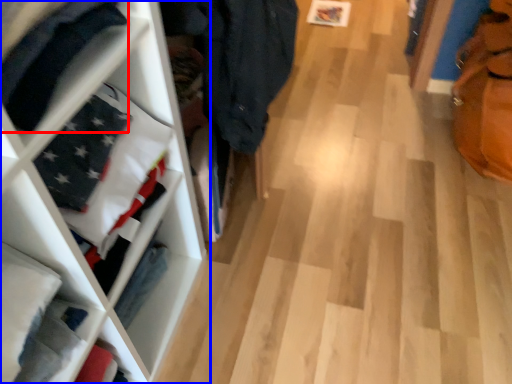
Question: Among these objects, which one is farthest to the camera, clothing (highlighted by a red box) or shelf (highlighted by a blue box)?

Choices:
 (A) clothing
 (B) shelf

Answer: (B)